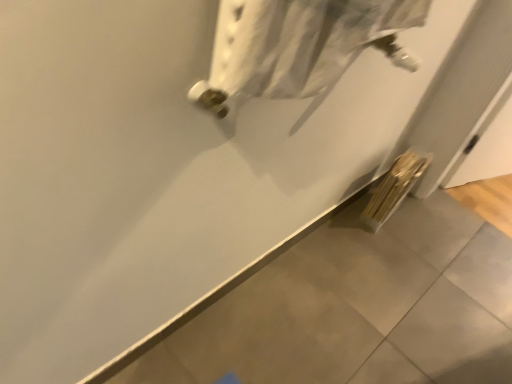
Question: Does white textured towel at upper center have a greater width compared to wooden sticks at lower right?

Choices:
 (A) yes
 (B) no

Answer: (B)

Question: Would you say white textured towel at upper center is a long distance from wooden sticks at lower right?

Choices:
 (A) no
 (B) yes

Answer: (A)

Question: From a real-world perspective, is white textured towel at upper center physically below wooden sticks at lower right?

Choices:
 (A) no
 (B) yes

Answer: (A)

Question: Is white textured towel at upper center bigger than wooden sticks at lower right?

Choices:
 (A) yes
 (B) no

Answer: (B)

Question: Could you tell me if white textured towel at upper center is facing wooden sticks at lower right?

Choices:
 (A) no
 (B) yes

Answer: (A)

Question: Considering the relative positions of white textured towel at upper center and wooden sticks at lower right in the image provided, is white textured towel at upper center to the left of wooden sticks at lower right from the viewer's perspective?

Choices:
 (A) no
 (B) yes

Answer: (B)

Question: Does wooden sticks at lower right have a greater height compared to white textured towel at upper center?

Choices:
 (A) no
 (B) yes

Answer: (B)

Question: Is wooden sticks at lower right to the right of white textured towel at upper center from the viewer's perspective?

Choices:
 (A) yes
 (B) no

Answer: (A)

Question: Is wooden sticks at lower right bigger than white textured towel at upper center?

Choices:
 (A) yes
 (B) no

Answer: (A)

Question: Is wooden sticks at lower right next to white textured towel at upper center and touching it?

Choices:
 (A) no
 (B) yes

Answer: (A)

Question: Is wooden sticks at lower right outside white textured towel at upper center?

Choices:
 (A) yes
 (B) no

Answer: (A)

Question: Does wooden sticks at lower right have a smaller size compared to white textured towel at upper center?

Choices:
 (A) yes
 (B) no

Answer: (B)

Question: Considering the positions of white textured towel at upper center and wooden sticks at lower right in the image, is white textured towel at upper center taller or shorter than wooden sticks at lower right?

Choices:
 (A) tall
 (B) short

Answer: (B)